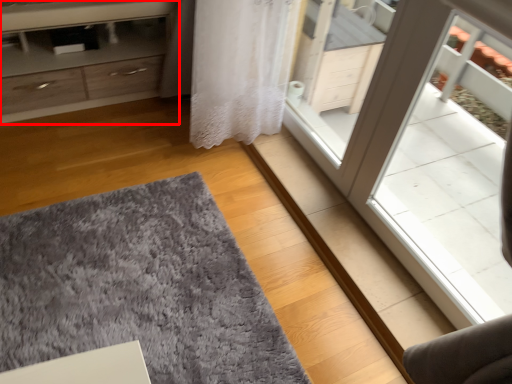
Question: From the image's perspective, where is chest of drawers (annotated by the red box) located relative to doormat?

Choices:
 (A) below
 (B) above

Answer: (B)